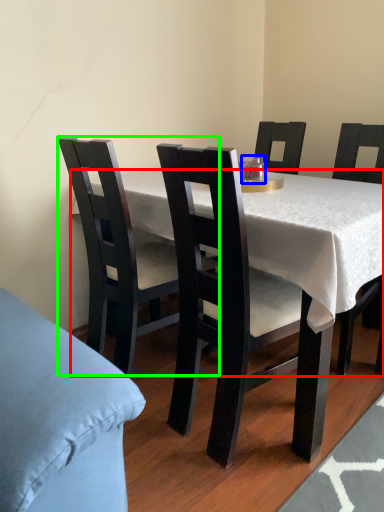
Question: Estimate the real-world distances between objects in this image. Which object is farther from desk (highlighted by a red box), coffee cup (highlighted by a blue box) or chair (highlighted by a green box)?

Choices:
 (A) coffee cup
 (B) chair

Answer: (A)